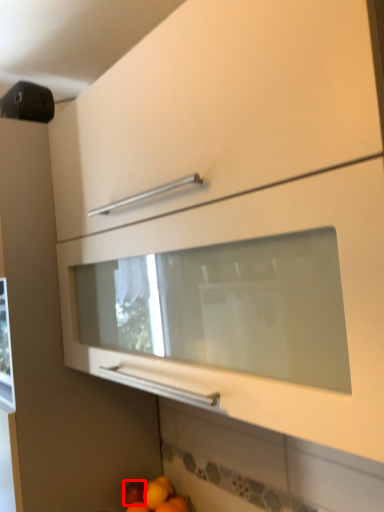
Question: Observing the image, what is the correct spatial positioning of apple (annotated by the red box) in reference to orange?

Choices:
 (A) left
 (B) right

Answer: (A)